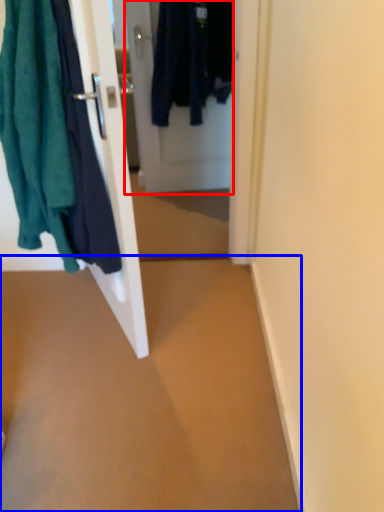
Question: Which object appears closest to the camera in this image, door (highlighted by a red box) or plain (highlighted by a blue box)?

Choices:
 (A) door
 (B) plain

Answer: (B)